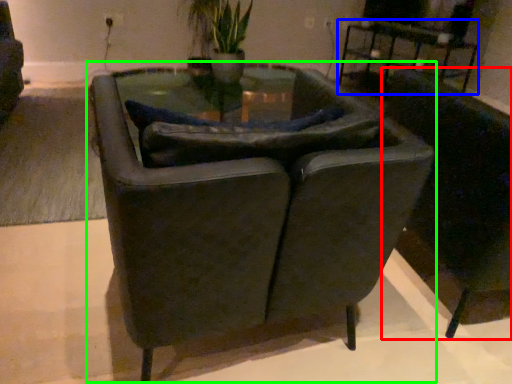
Question: Estimate the real-world distances between objects in this image. Which object is closer to chair (highlighted by a red box), table (highlighted by a blue box) or chair (highlighted by a green box)?

Choices:
 (A) table
 (B) chair

Answer: (B)